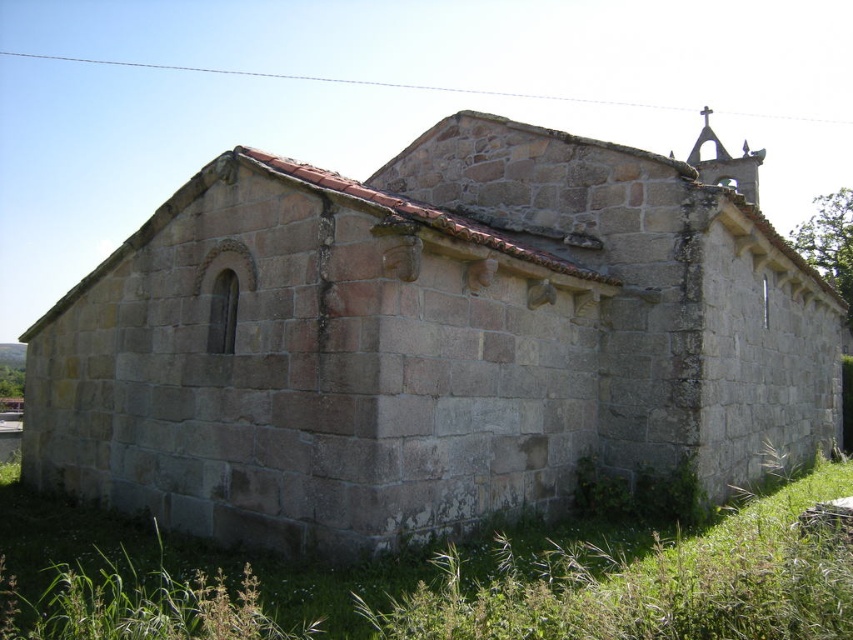
Question: Does gray stone church at center have a larger size compared to green grass at lower right?

Choices:
 (A) no
 (B) yes

Answer: (B)

Question: Which point is closer to the camera?

Choices:
 (A) green grass at lower right
 (B) gray stone church at center

Answer: (A)

Question: Which point is closer to the camera taking this photo?

Choices:
 (A) (729, 337)
 (B) (119, 580)

Answer: (B)

Question: Is the position of gray stone church at center less distant than that of green grass at lower right?

Choices:
 (A) no
 (B) yes

Answer: (A)

Question: Is gray stone church at center wider than green grass at lower right?

Choices:
 (A) no
 (B) yes

Answer: (B)